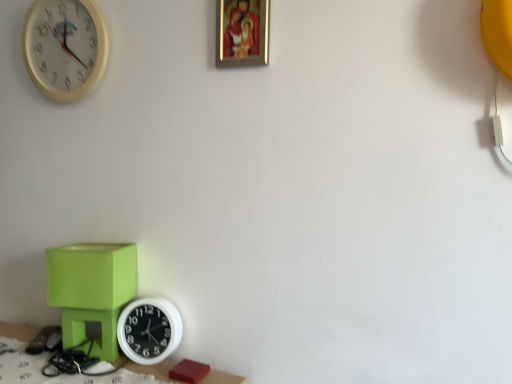
This screenshot has height=384, width=512. What do you see at coordinates (154, 369) in the screenshot?
I see `matte green table at lower left` at bounding box center [154, 369].

You are a GUI agent. You are given a task and a screenshot of the screen. Output one action in this format:
    pyautogui.click(x=<x>, y=<y>)
    Task: Click on the gold-framed picture at upper center
    This screenshot has height=384, width=512.
    Given the screenshot: What is the action you would take?
    pyautogui.click(x=242, y=33)

What do you see at coordinates (91, 291) in the screenshot? I see `matte green cube at lower left` at bounding box center [91, 291].

Where is `white plastic wall clock at upper left, which is the second wall clock in right-to-left order`? The width and height of the screenshot is (512, 384). white plastic wall clock at upper left, which is the second wall clock in right-to-left order is located at coordinates (64, 47).

Locate an element on the screen. The image size is (512, 384). matte green table at lower left is located at coordinates (154, 369).

From the image's perspective, which one is positioned higher, matte green table at lower left or white plastic wall clock at upper left, acting as the 1th wall clock starting from the top?

From the image's view, white plastic wall clock at upper left, acting as the 1th wall clock starting from the top, is above.

Find the location of a particular element. table beneath the white plastic wall clock at upper left, acting as the 1th wall clock starting from the top (from a real-world perspective) is located at coordinates (154, 369).

Does matte green table at lower left have a lesser height compared to white plastic wall clock at upper left, which is counted as the 1th wall clock, starting from the left?

Indeed, matte green table at lower left has a lesser height compared to white plastic wall clock at upper left, which is counted as the 1th wall clock, starting from the left.

From the image's perspective, is matte green table at lower left below white plastic wall clock at lower left, which is counted as the 2th wall clock, starting from the left?

Correct, matte green table at lower left appears lower than white plastic wall clock at lower left, which is counted as the 2th wall clock, starting from the left, in the image.

Does matte green table at lower left have a greater width compared to white plastic wall clock at lower left, which is counted as the 2th wall clock, starting from the left?

Indeed, matte green table at lower left has a greater width compared to white plastic wall clock at lower left, which is counted as the 2th wall clock, starting from the left.

Considering the positions of objects matte green table at lower left and white plastic wall clock at lower left, the second wall clock when ordered from top to bottom, in the image provided, who is in front, matte green table at lower left or white plastic wall clock at lower left, the second wall clock when ordered from top to bottom,?

Positioned in front is matte green table at lower left.

In the scene shown: Is white plastic wall clock at lower left, which is counted as the 2th wall clock, starting from the left, touching matte green table at lower left?

Yes, white plastic wall clock at lower left, which is counted as the 2th wall clock, starting from the left, is beside matte green table at lower left.

Is white plastic wall clock at lower left, the 1th wall clock in the right-to-left sequence, bigger or smaller than matte green table at lower left?

white plastic wall clock at lower left, the 1th wall clock in the right-to-left sequence, is smaller than matte green table at lower left.

Is white plastic wall clock at lower left, the 1th wall clock in the right-to-left sequence, positioned in front of matte green table at lower left?

No, it is not.

Looking at this image, which of these two, white plastic wall clock at lower left, the second wall clock when ordered from top to bottom, or matte green table at lower left, stands shorter?

With less height is matte green table at lower left.

Is matte green table at lower left next to matte green cube at lower left and touching it?

No, matte green table at lower left is not making contact with matte green cube at lower left.

Does matte green table at lower left lie behind matte green cube at lower left?

No, the depth of matte green table at lower left is less than that of matte green cube at lower left.

In the scene shown: Do you think matte green table at lower left is within matte green cube at lower left, or outside of it?

matte green table at lower left is not inside matte green cube at lower left, it's outside.

Considering the relative sizes of matte green table at lower left and matte green cube at lower left in the image provided, is matte green table at lower left thinner than matte green cube at lower left?

No, matte green table at lower left is not thinner than matte green cube at lower left.

Based on the photo, is white plastic wall clock at lower left, which is counted as the 2th wall clock, starting from the left, far from white plastic wall clock at upper left, acting as the 1th wall clock starting from the top?

No, there isn't a large distance between white plastic wall clock at lower left, which is counted as the 2th wall clock, starting from the left, and white plastic wall clock at upper left, acting as the 1th wall clock starting from the top.

From a real-world perspective, is white plastic wall clock at lower left, the 1th wall clock in the right-to-left sequence, located higher than white plastic wall clock at upper left, marked as the second wall clock in a bottom-to-top arrangement?

No.

Considering the sizes of objects white plastic wall clock at lower left, which is counted as the 2th wall clock, starting from the left, and white plastic wall clock at upper left, which is counted as the 1th wall clock, starting from the left, in the image provided, who is smaller, white plastic wall clock at lower left, which is counted as the 2th wall clock, starting from the left, or white plastic wall clock at upper left, which is counted as the 1th wall clock, starting from the left,?

With smaller size is white plastic wall clock at lower left, which is counted as the 2th wall clock, starting from the left.

Considering the relative sizes of gold-framed picture at upper center and white plastic wall clock at lower left, which is counted as the 2th wall clock, starting from the left, in the image provided, is gold-framed picture at upper center shorter than white plastic wall clock at lower left, which is counted as the 2th wall clock, starting from the left,?

No.

Is gold-framed picture at upper center next to white plastic wall clock at lower left, which is the first wall clock in bottom-to-top order, and touching it?

They are not placed beside each other.

Who is bigger, gold-framed picture at upper center or white plastic wall clock at lower left, the second wall clock when ordered from top to bottom?

Bigger between the two is white plastic wall clock at lower left, the second wall clock when ordered from top to bottom.

Where is `wall clock that is the 1st object to the left of the gold-framed picture at upper center, starting at the anchor`? This screenshot has height=384, width=512. wall clock that is the 1st object to the left of the gold-framed picture at upper center, starting at the anchor is located at coordinates (149, 330).

The width and height of the screenshot is (512, 384). Identify the location of picture frame lying on the right of matte green cube at lower left. (242, 33).

Is matte green cube at lower left to the left or to the right of gold-framed picture at upper center in the image?

Clearly, matte green cube at lower left is on the left of gold-framed picture at upper center in the image.

From the image's perspective, is matte green cube at lower left located above or below gold-framed picture at upper center?

matte green cube at lower left is below gold-framed picture at upper center.

Does matte green cube at lower left turn towards gold-framed picture at upper center?

No, matte green cube at lower left is not turned towards gold-framed picture at upper center.

From the image's perspective, count 2nd wall clocks upward from the matte green table at lower left and point to it. Please provide its 2D coordinates.

[(64, 47)]

Which wall clock is the 1st one when counting from the back of the matte green table at lower left? Please provide its 2D coordinates.

[(149, 330)]

Estimate the real-world distances between objects in this image. Which object is closer to gold-framed picture at upper center, white plastic wall clock at lower left, which is the first wall clock in bottom-to-top order, or matte green cube at lower left?

The object closer to gold-framed picture at upper center is matte green cube at lower left.

Estimate the real-world distances between objects in this image. Which object is further from white plastic wall clock at upper left, acting as the 1th wall clock starting from the top, matte green cube at lower left or gold-framed picture at upper center?

The object further to white plastic wall clock at upper left, acting as the 1th wall clock starting from the top, is matte green cube at lower left.

Looking at the image, which one is located further to white plastic wall clock at upper left, which is the second wall clock in right-to-left order, gold-framed picture at upper center or matte green cube at lower left?

Based on the image, matte green cube at lower left appears to be further to white plastic wall clock at upper left, which is the second wall clock in right-to-left order.

When comparing their distances from white plastic wall clock at lower left, the second wall clock when ordered from top to bottom, does white plastic wall clock at upper left, which is counted as the 1th wall clock, starting from the left, or matte green table at lower left seem further?

Based on the image, white plastic wall clock at upper left, which is counted as the 1th wall clock, starting from the left, appears to be further to white plastic wall clock at lower left, the second wall clock when ordered from top to bottom.

Based on their spatial positions, is gold-framed picture at upper center or white plastic wall clock at upper left, marked as the second wall clock in a bottom-to-top arrangement, closer to white plastic wall clock at lower left, the 1th wall clock in the right-to-left sequence?

gold-framed picture at upper center is positioned closer to the anchor white plastic wall clock at lower left, the 1th wall clock in the right-to-left sequence.

Estimate the real-world distances between objects in this image. Which object is closer to gold-framed picture at upper center, matte green cube at lower left or matte green table at lower left?

matte green cube at lower left is closer to gold-framed picture at upper center.

From the image, which object appears to be farther from white plastic wall clock at lower left, the second wall clock when ordered from top to bottom, matte green table at lower left or white plastic wall clock at upper left, acting as the 1th wall clock starting from the top?

The object further to white plastic wall clock at lower left, the second wall clock when ordered from top to bottom, is white plastic wall clock at upper left, acting as the 1th wall clock starting from the top.

Based on their spatial positions, is white plastic wall clock at lower left, which is counted as the 2th wall clock, starting from the left, or matte green table at lower left further from white plastic wall clock at upper left, acting as the 1th wall clock starting from the top?

matte green table at lower left is further to white plastic wall clock at upper left, acting as the 1th wall clock starting from the top.

Locate an element on the screen. This screenshot has width=512, height=384. picture frame between white plastic wall clock at upper left, which is counted as the 1th wall clock, starting from the left, and matte green table at lower left vertically is located at coordinates (242, 33).

At what (x,y) coordinates should I click in order to perform the action: click on toy between gold-framed picture at upper center and matte green table at lower left in the vertical direction. Please return your answer as a coordinate pair (x, y). Image resolution: width=512 pixels, height=384 pixels. Looking at the image, I should click on (91, 291).

This screenshot has width=512, height=384. Identify the location of wall clock between gold-framed picture at upper center and matte green table at lower left in the up-down direction. (149, 330).

Locate an element on the screen. Image resolution: width=512 pixels, height=384 pixels. toy that lies between white plastic wall clock at upper left, which is counted as the 1th wall clock, starting from the left, and white plastic wall clock at lower left, the 1th wall clock in the right-to-left sequence, from top to bottom is located at coordinates (91, 291).